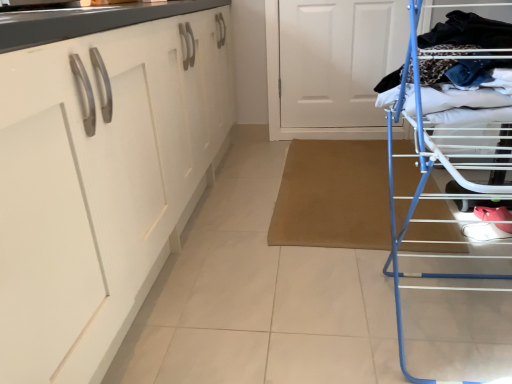
Question: Can you confirm if white matte door at upper center is bigger than white glossy cabinet at left?

Choices:
 (A) no
 (B) yes

Answer: (A)

Question: Can you confirm if white matte door at upper center is smaller than white glossy cabinet at left?

Choices:
 (A) no
 (B) yes

Answer: (B)

Question: From a real-world perspective, is white matte door at upper center physically above white glossy cabinet at left?

Choices:
 (A) no
 (B) yes

Answer: (A)

Question: Does white matte door at upper center have a greater width compared to white glossy cabinet at left?

Choices:
 (A) yes
 (B) no

Answer: (B)

Question: Does white matte door at upper center have a lesser width compared to white glossy cabinet at left?

Choices:
 (A) yes
 (B) no

Answer: (A)

Question: Would you say white matte door at upper center is outside white glossy cabinet at left?

Choices:
 (A) no
 (B) yes

Answer: (B)

Question: Is blue metal drying rack at right bigger than white glossy cabinet at left?

Choices:
 (A) yes
 (B) no

Answer: (B)

Question: From a real-world perspective, does blue metal drying rack at right stand above white glossy cabinet at left?

Choices:
 (A) yes
 (B) no

Answer: (B)

Question: Can you confirm if blue metal drying rack at right is shorter than white glossy cabinet at left?

Choices:
 (A) no
 (B) yes

Answer: (B)

Question: Is there a large distance between blue metal drying rack at right and white glossy cabinet at left?

Choices:
 (A) yes
 (B) no

Answer: (B)

Question: Is blue metal drying rack at right outside of white glossy cabinet at left?

Choices:
 (A) no
 (B) yes

Answer: (B)

Question: From the image's perspective, is blue metal drying rack at right on white glossy cabinet at left?

Choices:
 (A) no
 (B) yes

Answer: (A)

Question: Can you confirm if white glossy cabinet at left is positioned to the right of white matte door at upper center?

Choices:
 (A) no
 (B) yes

Answer: (A)